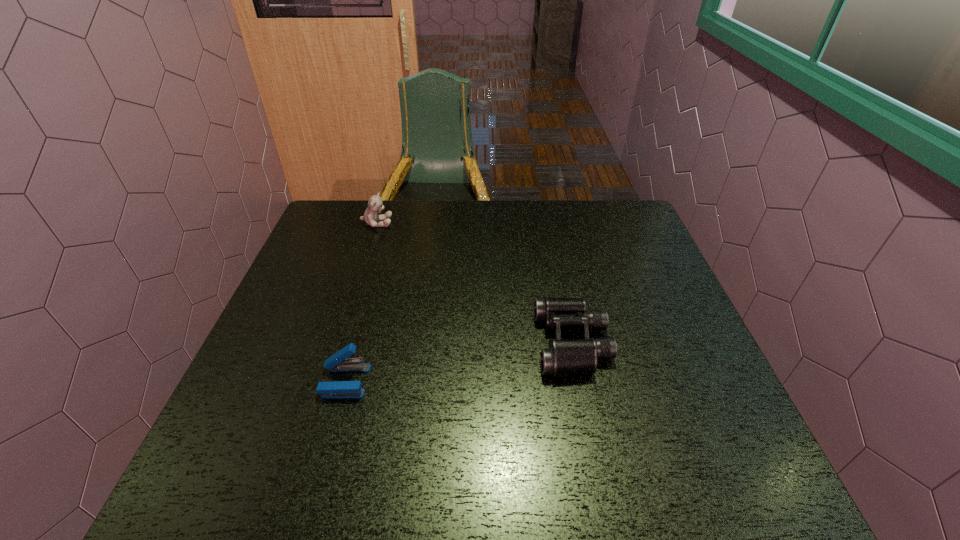
Where is `blank area in the image that satisfies the following two spatial constraints: 1. on the face of the stapler; 2. on the right side of the teddy bear`? This screenshot has height=540, width=960. blank area in the image that satisfies the following two spatial constraints: 1. on the face of the stapler; 2. on the right side of the teddy bear is located at coordinates (327, 381).

This screenshot has height=540, width=960. In order to click on vacant area in the image that satisfies the following two spatial constraints: 1. on the back side of the stapler; 2. on the face of the teddy bear in this screenshot , I will do `click(389, 223)`.

Find the location of a particular element. free region that satisfies the following two spatial constraints: 1. on the front-facing side of the rightmost object; 2. on the front side of the stapler is located at coordinates (581, 381).